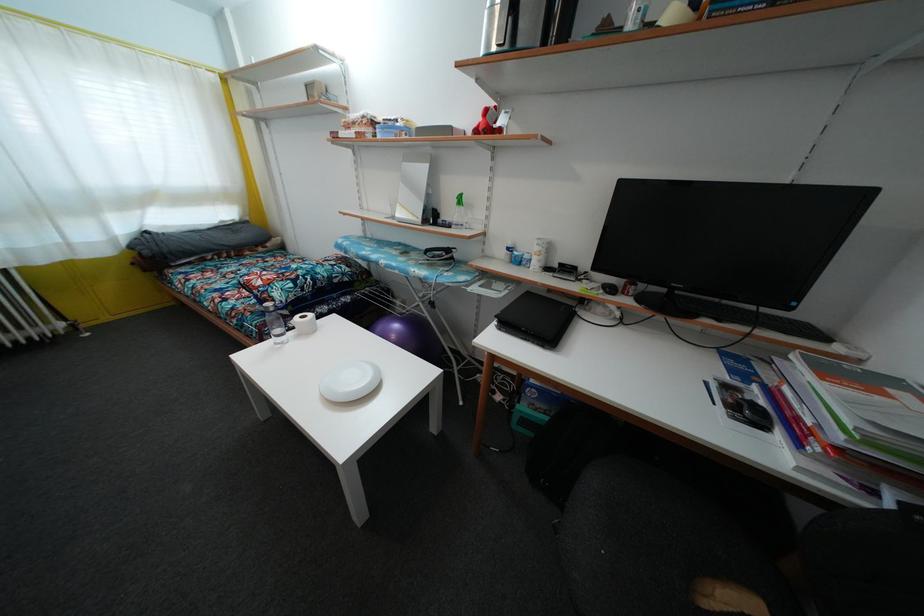
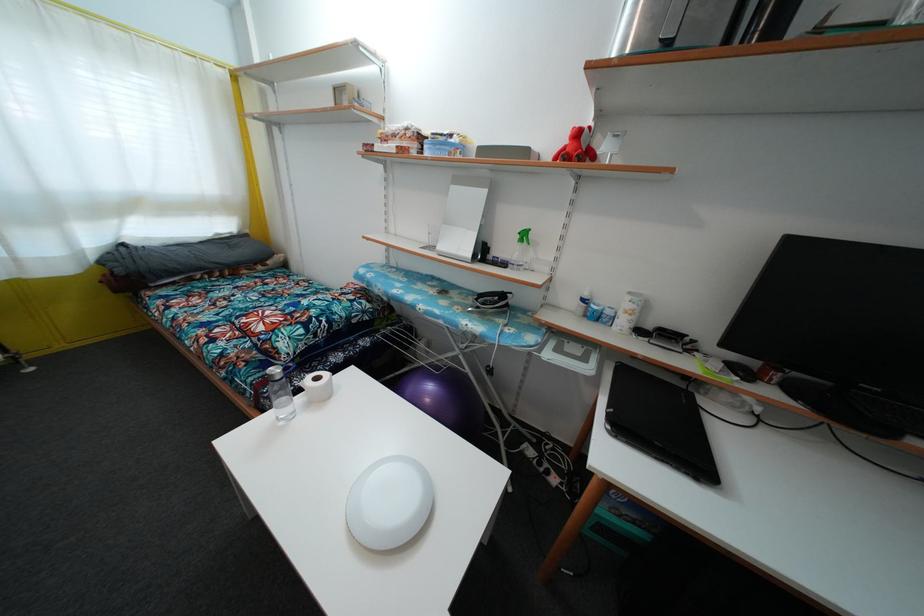
Locate, in the second image, the point that corresponds to point (307, 323) in the first image.

(321, 386)